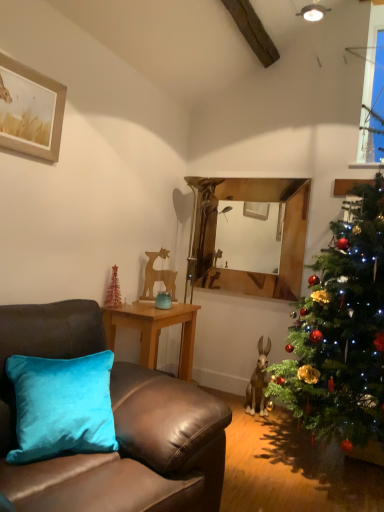
Question: From the image's perspective, is green matte christmas tree at right above or below clear glass window at upper right?

Choices:
 (A) above
 (B) below

Answer: (B)

Question: Is green matte christmas tree at right bigger or smaller than clear glass window at upper right?

Choices:
 (A) big
 (B) small

Answer: (A)

Question: Which of these objects is positioned farthest from the velvet brown couch at left?

Choices:
 (A) teal velvet vase at center
 (B) woodenobject at center
 (C) metallic gold christmas tree at lower left
 (D) wooden picture frame at upper left
 (E) green matte christmas tree at right

Answer: (A)

Question: Based on their relative distances, which object is nearer to the clear glass window at upper right?

Choices:
 (A) metallic gold christmas tree at lower left
 (B) velvet brown couch at left
 (C) wooden picture frame at upper left
 (D) green matte christmas tree at right
 (E) woodenobject at center

Answer: (D)